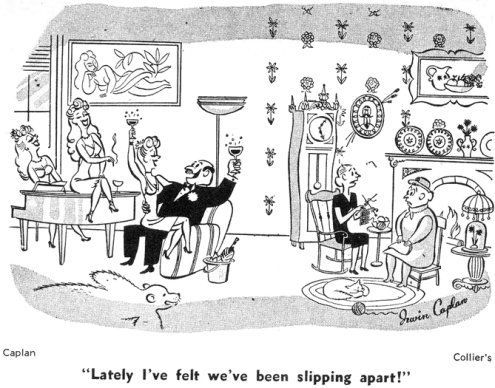
Locate an element on the screen. Image resolution: width=495 pixels, height=388 pixels. piano is located at coordinates (68, 210).